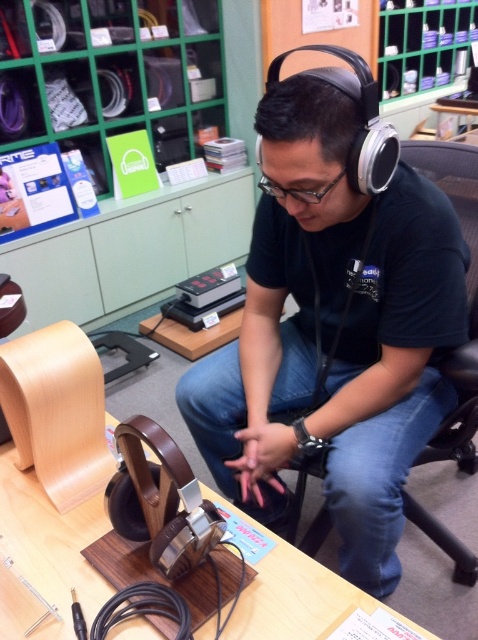
Does matte black headphones at center come in front of brown wood table at center?

No, it is not.

Does point (306, 289) lie behind point (108, 419)?

Yes.

The image size is (478, 640). In order to click on matte black headphones at center in this screenshot , I will do `click(334, 332)`.

Locate an element on the screen. The width and height of the screenshot is (478, 640). matte black headphones at center is located at coordinates (334, 332).